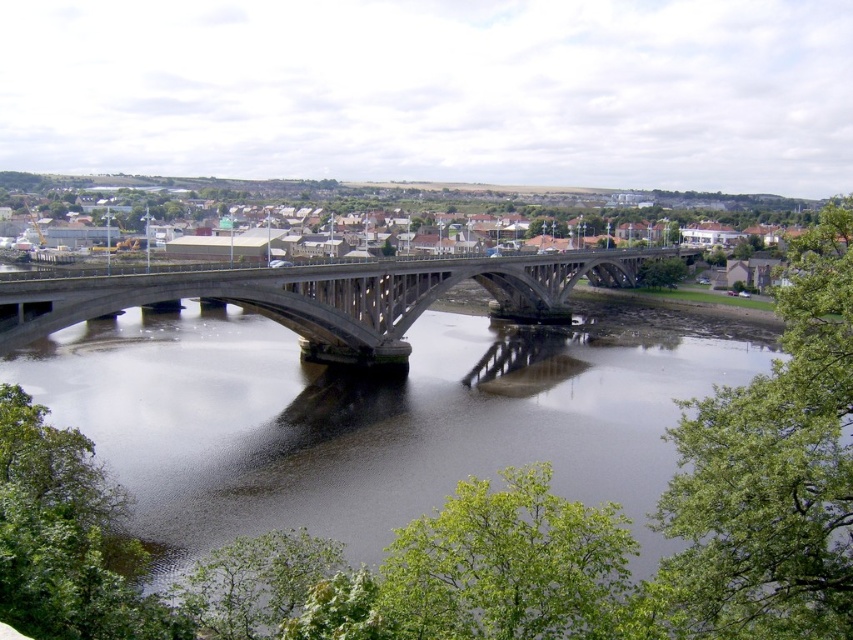
Question: Does brown concrete river at center appear on the left side of concrete bridge at center?

Choices:
 (A) no
 (B) yes

Answer: (A)

Question: Can you confirm if brown concrete river at center is wider than concrete bridge at center?

Choices:
 (A) yes
 (B) no

Answer: (B)

Question: Which of the following is the farthest from the observer?

Choices:
 (A) concrete bridge at center
 (B) brown concrete river at center

Answer: (A)

Question: Is brown concrete river at center smaller than concrete bridge at center?

Choices:
 (A) no
 (B) yes

Answer: (B)